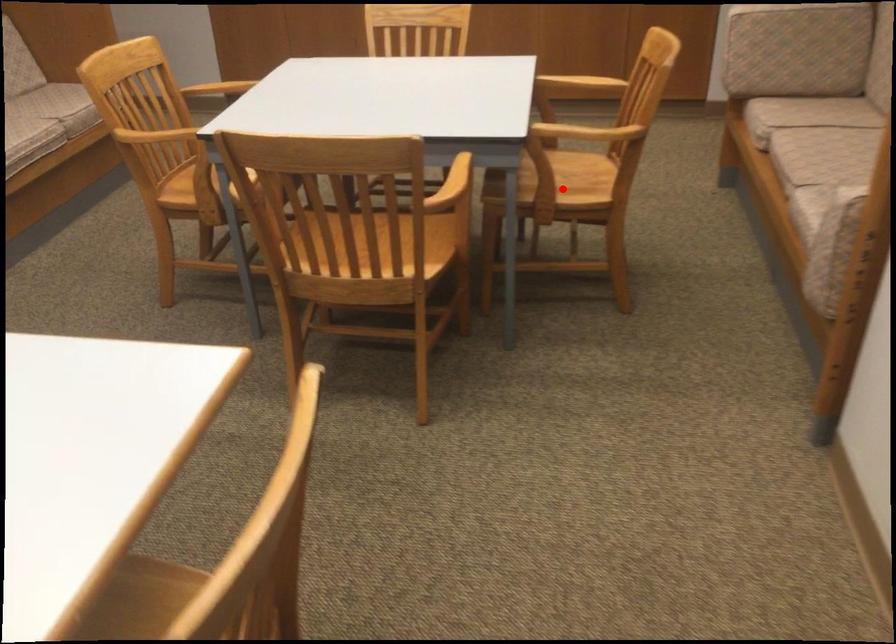
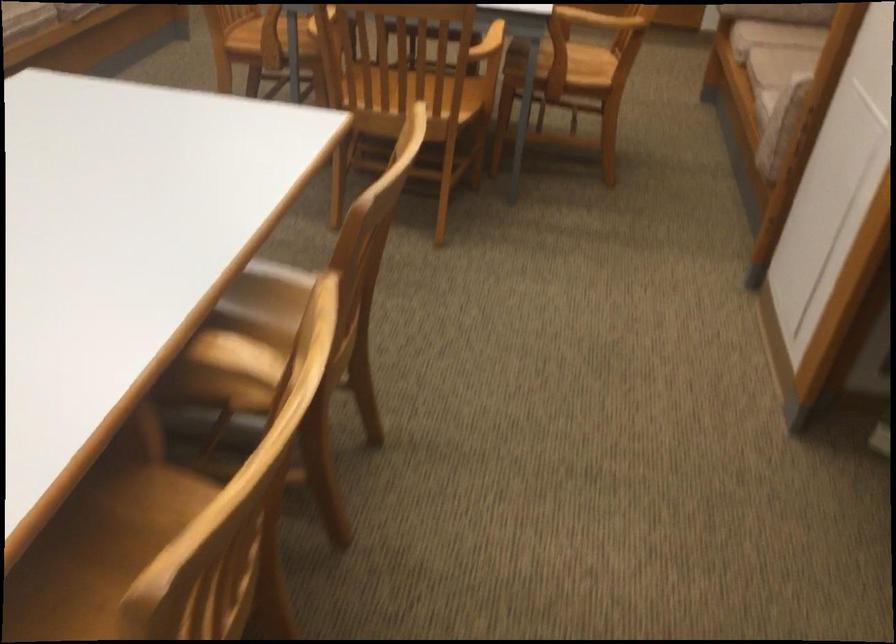
Question: I am providing you with two images of the same scene from different viewpoints. Given a red point in image1, look at the same physical point in image2. Is it:

Choices:
 (A) Closer to the viewpoint
 (B) Farther from the viewpoint

Answer: (B)